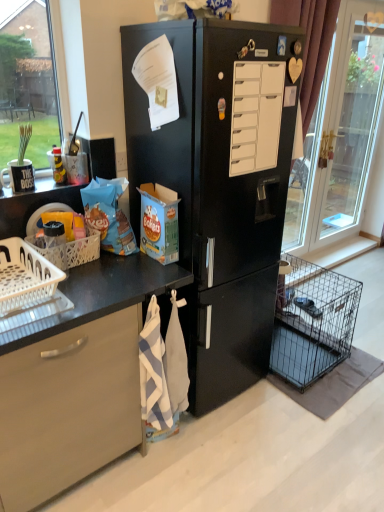
What do you see at coordinates (312, 321) in the screenshot?
I see `black wire dog crate at lower right` at bounding box center [312, 321].

This screenshot has height=512, width=384. Identify the location of white plastic basket at left, which is counted as the 1th basket, starting from the front. (25, 276).

Identify the location of white plastic basket at lower left, the 2th basket in the front-to-back sequence. The height and width of the screenshot is (512, 384). (68, 251).

What do you see at coordinates (256, 116) in the screenshot? I see `white matte drawer at center` at bounding box center [256, 116].

The width and height of the screenshot is (384, 512). Find the location of `white matte drawer at center`. white matte drawer at center is located at coordinates (256, 116).

Find the location of `black wire dog crate at lower right`. black wire dog crate at lower right is located at coordinates (312, 321).

Does white matte drawer at center touch white plastic basket at left, which is counted as the 1th basket, starting from the front?

No, white matte drawer at center is not beside white plastic basket at left, which is counted as the 1th basket, starting from the front.

Which is closer, (277, 86) or (27, 287)?

Positioned in front is point (27, 287).

Relative to white plastic basket at left, the 2th basket when ordered from back to front, is white matte drawer at center in front or behind?

Visually, white matte drawer at center is located behind white plastic basket at left, the 2th basket when ordered from back to front.

Can you confirm if white matte drawer at center is wider than white plastic basket at left, which is counted as the 1th basket, starting from the front?

Incorrect, the width of white matte drawer at center does not surpass that of white plastic basket at left, which is counted as the 1th basket, starting from the front.

From a real-world perspective, between white plastic basket at left, which is counted as the 1th basket, starting from the front, and black matte refrigerator at center, who is vertically lower?

In real-world perspective, black matte refrigerator at center is lower.

Which of these two, white plastic basket at left, which is counted as the 1th basket, starting from the front, or black matte refrigerator at center, is wider?

black matte refrigerator at center is wider.

Consider the image. Which of these two, white plastic basket at left, which is counted as the 1th basket, starting from the front, or black matte refrigerator at center, is bigger?

Bigger between the two is black matte refrigerator at center.

From a real-world perspective, who is located higher, white plastic basket at lower left, the 1th basket when ordered from back to front, or white matte drawer at center?

In real-world perspective, white matte drawer at center is above.

Could you measure the distance between white plastic basket at lower left, the 1th basket when ordered from back to front, and white matte drawer at center?

white plastic basket at lower left, the 1th basket when ordered from back to front, and white matte drawer at center are 31.39 inches apart from each other.

Is white plastic basket at lower left, the 2th basket in the front-to-back sequence, next to white matte drawer at center and touching it?

No, white plastic basket at lower left, the 2th basket in the front-to-back sequence, is not in contact with white matte drawer at center.

Looking at this image, from the image's perspective, is transparent glass door at right located beneath white striped towel at lower center?

No, from the image's perspective, transparent glass door at right is not below white striped towel at lower center.

Can you confirm if transparent glass door at right is bigger than white striped towel at lower center?

Indeed, transparent glass door at right has a larger size compared to white striped towel at lower center.

Is point (344, 83) positioned in front of point (176, 304)?

That is False.

Between black matte refrigerator at center and transparent glass door at right, which one has larger size?

Bigger between the two is black matte refrigerator at center.

Considering the relative sizes of black matte refrigerator at center and transparent glass door at right in the image provided, is black matte refrigerator at center shorter than transparent glass door at right?

Yes, black matte refrigerator at center is shorter than transparent glass door at right.

Does black matte refrigerator at center turn towards transparent glass door at right?

No, black matte refrigerator at center is not turned towards transparent glass door at right.

Does black matte refrigerator at center come in front of transparent glass door at right?

Yes, it is.

Is white plastic basket at left, which is counted as the 1th basket, starting from the front, next to white striped towel at lower center?

No, white plastic basket at left, which is counted as the 1th basket, starting from the front, is not making contact with white striped towel at lower center.

How many degrees apart are the facing directions of white plastic basket at left, the 2th basket when ordered from back to front, and white striped towel at lower center?

The angular difference between white plastic basket at left, the 2th basket when ordered from back to front, and white striped towel at lower center is 1.06 degrees.

Considering the points (28, 291) and (181, 346), which point is behind, point (28, 291) or point (181, 346)?

The point (181, 346) is behind.

From a real-world perspective, which is physically above, white plastic basket at left, the 2th basket when ordered from back to front, or white striped towel at lower center?

white plastic basket at left, the 2th basket when ordered from back to front, is physically above.

Measure the distance from white striped towel at lower center to white plastic basket at lower left, the 2th basket in the front-to-back sequence.

20.71 inches.

Can you confirm if white striped towel at lower center is positioned to the right of white plastic basket at lower left, the 1th basket when ordered from back to front?

Indeed, white striped towel at lower center is positioned on the right side of white plastic basket at lower left, the 1th basket when ordered from back to front.

From a real-world perspective, is white striped towel at lower center located beneath white plastic basket at lower left, the 2th basket in the front-to-back sequence?

Correct, in the physical world, white striped towel at lower center is lower than white plastic basket at lower left, the 2th basket in the front-to-back sequence.

Locate an element on the screen. The width and height of the screenshot is (384, 512). material on the right of white plastic basket at lower left, the 1th basket when ordered from back to front is located at coordinates pyautogui.click(x=162, y=370).

Find the location of a particular element. This screenshot has height=512, width=384. drawer behind the white plastic basket at left, which is counted as the 1th basket, starting from the front is located at coordinates (256, 116).

Image resolution: width=384 pixels, height=512 pixels. Find the location of `the 1st basket directly above the black matte refrigerator at center (from a real-world perspective)`. the 1st basket directly above the black matte refrigerator at center (from a real-world perspective) is located at coordinates (25, 276).

Estimate the real-world distances between objects in this image. Which object is further from white plastic basket at left, the 2th basket when ordered from back to front, black matte refrigerator at center or white plastic basket at lower left, the 1th basket when ordered from back to front?

black matte refrigerator at center is positioned further to the anchor white plastic basket at left, the 2th basket when ordered from back to front.

Estimate the real-world distances between objects in this image. Which object is further from black matte refrigerator at center, black wire dog crate at lower right or transparent glass door at right?

Among the two, transparent glass door at right is located further to black matte refrigerator at center.

In the scene shown: From the image, which object appears to be nearer to white plastic basket at left, the 2th basket when ordered from back to front, transparent glass door at right or white matte drawer at center?

Based on the image, white matte drawer at center appears to be nearer to white plastic basket at left, the 2th basket when ordered from back to front.

Looking at the image, which one is located further to white matte drawer at center, black matte refrigerator at center or transparent glass door at right?

The object further to white matte drawer at center is transparent glass door at right.

Based on their spatial positions, is white matte drawer at center or white striped towel at lower center closer to white plastic basket at left, the 2th basket when ordered from back to front?

Based on the image, white striped towel at lower center appears to be nearer to white plastic basket at left, the 2th basket when ordered from back to front.

When comparing their distances from white plastic basket at lower left, the 1th basket when ordered from back to front, does white plastic basket at left, which is counted as the 1th basket, starting from the front, or black matte refrigerator at center seem further?

black matte refrigerator at center.

Considering their positions, is white striped towel at lower center positioned closer to black wire dog crate at lower right than black matte refrigerator at center?

black matte refrigerator at center lies closer to black wire dog crate at lower right than the other object.

Estimate the real-world distances between objects in this image. Which object is closer to black wire dog crate at lower right, white plastic basket at left, which is counted as the 1th basket, starting from the front, or white matte drawer at center?

white matte drawer at center is positioned closer to the anchor black wire dog crate at lower right.

This screenshot has height=512, width=384. I want to click on basket between white plastic basket at left, which is counted as the 1th basket, starting from the front, and black wire dog crate at lower right from left to right, so click(68, 251).

Where is `material between white plastic basket at left, the 2th basket when ordered from back to front, and black matte refrigerator at center`? material between white plastic basket at left, the 2th basket when ordered from back to front, and black matte refrigerator at center is located at coordinates (162, 370).

This screenshot has width=384, height=512. Find the location of `refrigerator between white matte drawer at center and white striped towel at lower center vertically`. refrigerator between white matte drawer at center and white striped towel at lower center vertically is located at coordinates (219, 190).

You are a GUI agent. You are given a task and a screenshot of the screen. Output one action in this format:
    pyautogui.click(x=<x>, y=<y>)
    Task: Click on the refrigerator situated between white plastic basket at lower left, the 1th basket when ordered from back to front, and white matte drawer at center from left to right
    The width and height of the screenshot is (384, 512).
    Given the screenshot: What is the action you would take?
    pyautogui.click(x=219, y=190)